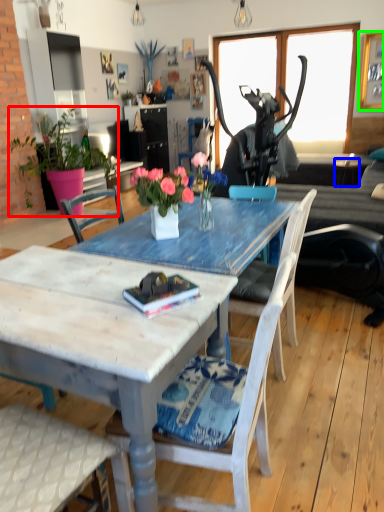
Question: Estimate the real-world distances between objects in this image. Which object is farther from houseplant (highlighted by a red box), side table (highlighted by a blue box) or picture frame (highlighted by a green box)?

Choices:
 (A) side table
 (B) picture frame

Answer: (B)